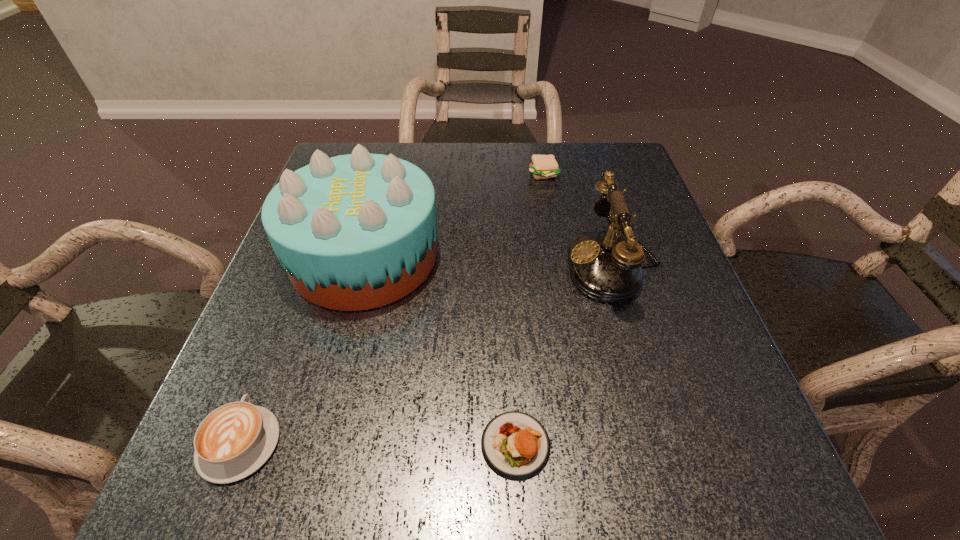
Where is `free point that satisfies the following two spatial constraints: 1. on the side of the taller patty (food) with the handle; 2. on the left side of the cappuccino`? The height and width of the screenshot is (540, 960). free point that satisfies the following two spatial constraints: 1. on the side of the taller patty (food) with the handle; 2. on the left side of the cappuccino is located at coordinates (344, 174).

Identify the location of free space that satisfies the following two spatial constraints: 1. on the side of the farther patty (food) with the handle; 2. on the left side of the cappuccino. Image resolution: width=960 pixels, height=540 pixels. (344, 174).